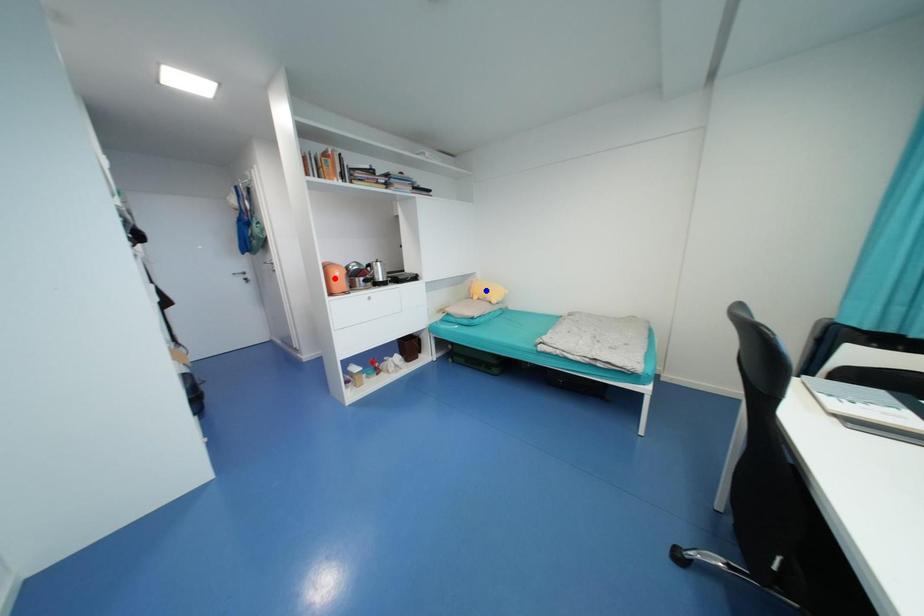
Question: Which of the two points in the image is closer to the camera?

Choices:
 (A) Blue point is closer.
 (B) Red point is closer.

Answer: (B)